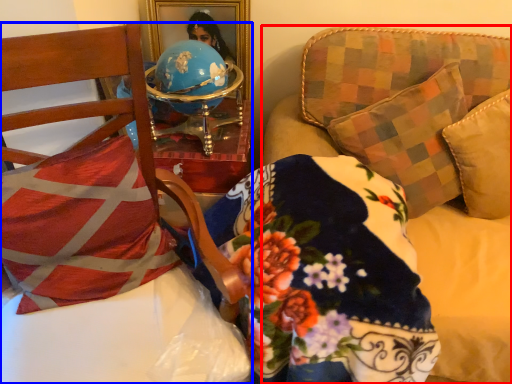
Question: Which point is closer to the camera, studio couch (highlighted by a red box) or furniture (highlighted by a blue box)?

Choices:
 (A) studio couch
 (B) furniture

Answer: (B)